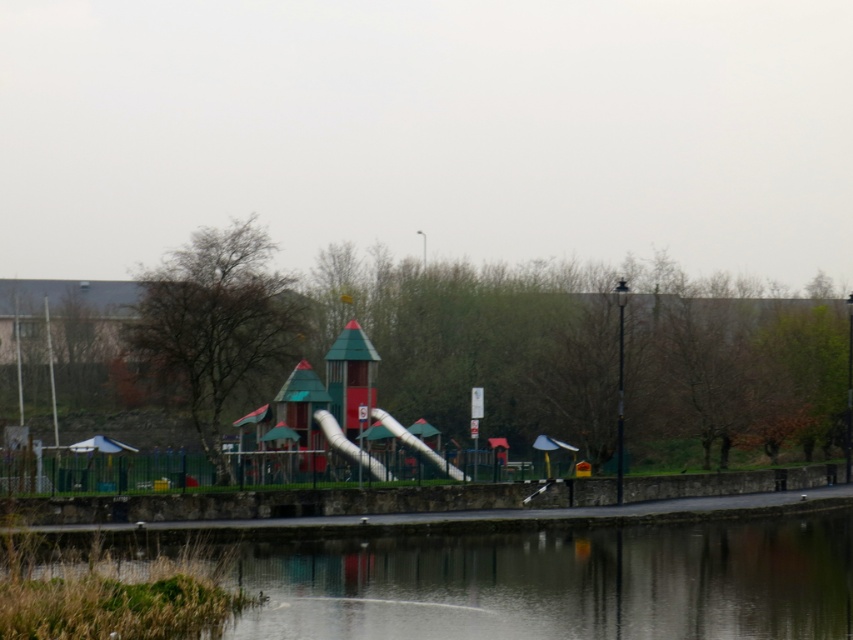
Question: Does transparent glass water at center have a greater width compared to smooth plastic slide at center?

Choices:
 (A) yes
 (B) no

Answer: (A)

Question: Which of the following is the closest to the observer?

Choices:
 (A) (618, 611)
 (B) (357, 449)

Answer: (A)

Question: Which is farther from the smooth plastic slide at center?

Choices:
 (A) white plastic slide at center
 (B) transparent glass water at center

Answer: (B)

Question: Which point is closer to the camera?

Choices:
 (A) (721, 576)
 (B) (401, 435)

Answer: (A)

Question: Does transparent glass water at center appear under white plastic slide at center?

Choices:
 (A) no
 (B) yes

Answer: (B)

Question: Does transparent glass water at center have a larger size compared to white plastic slide at center?

Choices:
 (A) no
 (B) yes

Answer: (B)